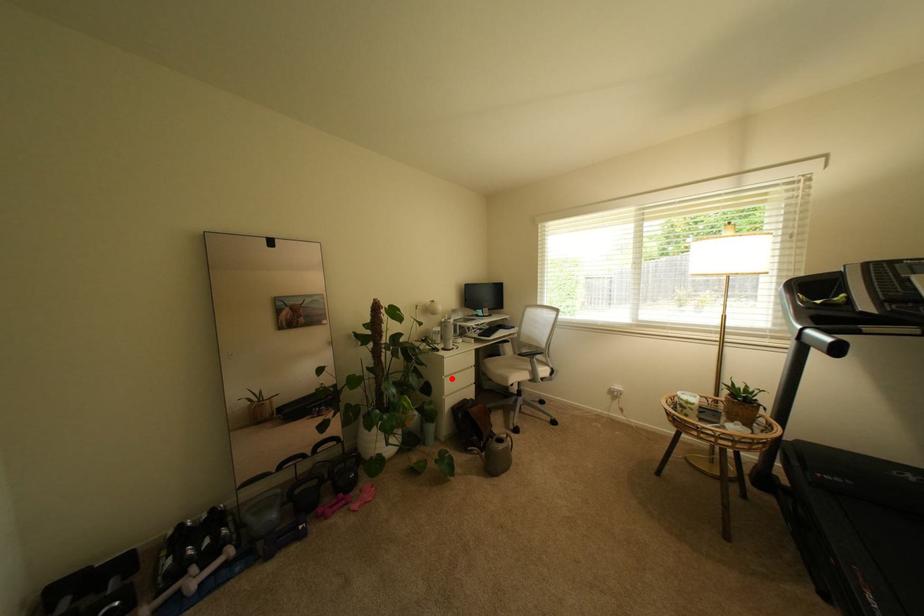
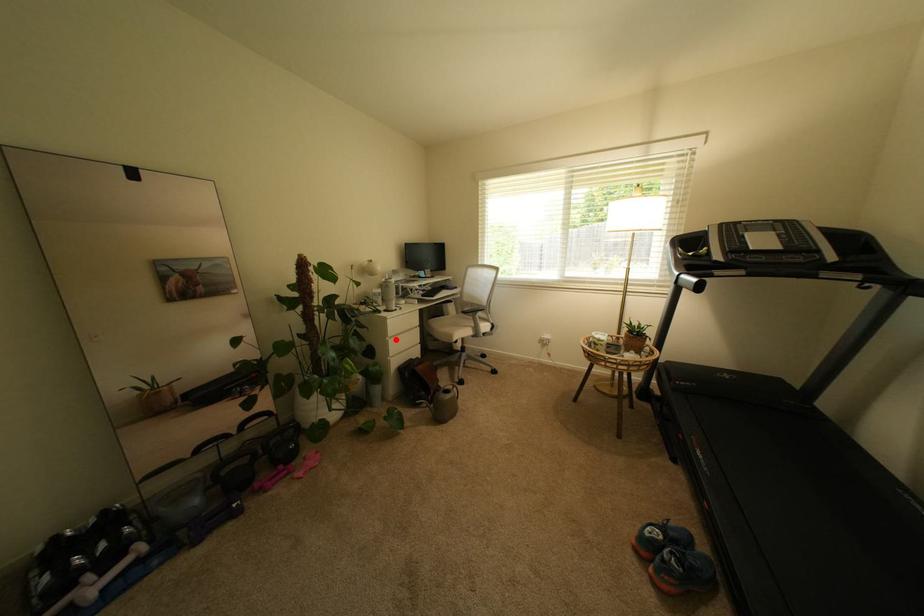
I am providing you with two images of the same scene from different viewpoints. A red point is marked on the first image and another point is marked on the second image. Is the marked point in image1 the same physical position as the marked point in image2?

Yes